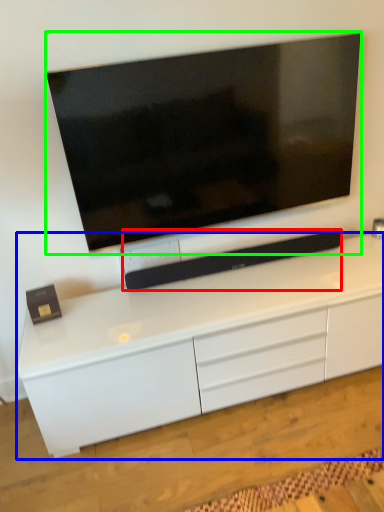
Question: Which is farther away from equipment (highlighted by a red box)? cabinetry (highlighted by a blue box) or television (highlighted by a green box)?

Choices:
 (A) cabinetry
 (B) television

Answer: (B)